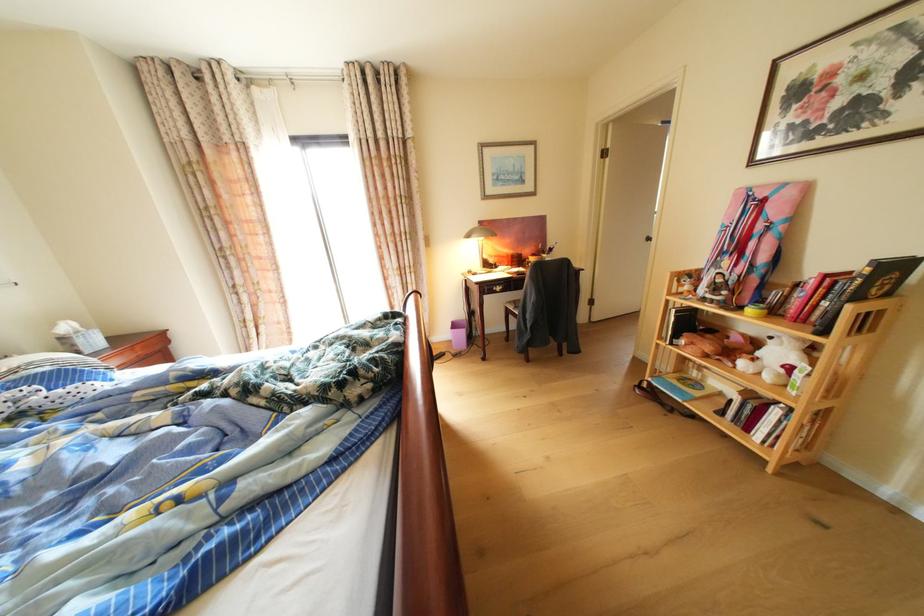
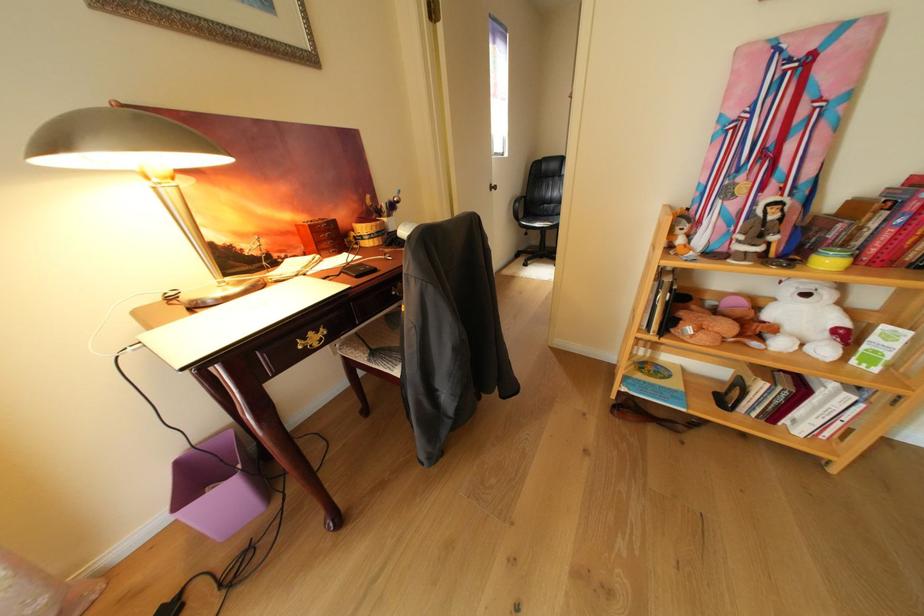
In the second image, find the point that corresponds to the point at 784,339 in the first image.

(820, 297)